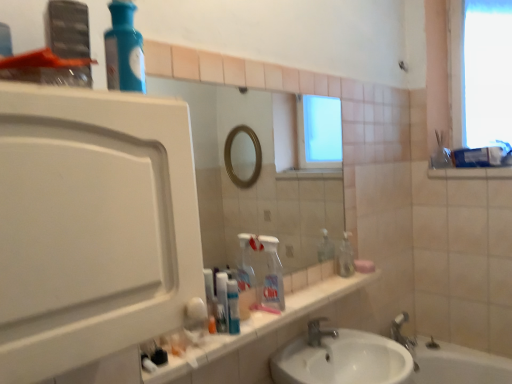
What do you see at coordinates (318, 331) in the screenshot?
I see `silver metallic faucet at sink center` at bounding box center [318, 331].

The image size is (512, 384). What do you see at coordinates (364, 266) in the screenshot? I see `pink matte soap at right` at bounding box center [364, 266].

Where is `white plastic toothpaste tube at center`? white plastic toothpaste tube at center is located at coordinates (222, 300).

The width and height of the screenshot is (512, 384). What do you see at coordinates (92, 225) in the screenshot? I see `white matte cabinet at left` at bounding box center [92, 225].

Identify the location of silver metallic faucet at sink center. The height and width of the screenshot is (384, 512). 318,331.

Starting from the pink matte soap at right, which cleaning product is the 1st one to the left? Please provide its 2D coordinates.

[(272, 274)]

How far apart are clear plastic bottle at center, which is the 1th cleaning product from back to front, and pink matte soap at right?

48.82 centimeters.

Between clear plastic bottle at center, the 2th cleaning product positioned from the front, and pink matte soap at right, which one has more height?

clear plastic bottle at center, the 2th cleaning product positioned from the front.

Considering the relative sizes of clear plastic bottle at center, the 2th cleaning product positioned from the front, and pink matte soap at right in the image provided, is clear plastic bottle at center, the 2th cleaning product positioned from the front, bigger than pink matte soap at right?

Yes, clear plastic bottle at center, the 2th cleaning product positioned from the front, is bigger than pink matte soap at right.

Would you say white glossy sink at lower center is outside clear plastic bottle at center, the 2th cleaning product positioned from the front?

Yes, white glossy sink at lower center is outside of clear plastic bottle at center, the 2th cleaning product positioned from the front.

In the scene shown: Considering the relative positions of white glossy sink at lower center and clear plastic bottle at center, which appears as the first cleaning product when ordered from the bottom, in the image provided, is white glossy sink at lower center to the left of clear plastic bottle at center, which appears as the first cleaning product when ordered from the bottom, from the viewer's perspective?

In fact, white glossy sink at lower center is to the right of clear plastic bottle at center, which appears as the first cleaning product when ordered from the bottom.

Is white glossy sink at lower center facing away from clear plastic bottle at center, the second cleaning product positioned from the top?

No, clear plastic bottle at center, the second cleaning product positioned from the top, is not at the back of white glossy sink at lower center.

Considering the positions of objects white matte cabinet at left and white glossy sink at lower center in the image provided, who is more to the right, white matte cabinet at left or white glossy sink at lower center?

white glossy sink at lower center.

Can you confirm if white matte cabinet at left is thinner than white glossy sink at lower center?

Yes, white matte cabinet at left is thinner than white glossy sink at lower center.

Is white matte cabinet at left located outside white glossy sink at lower center?

Indeed, white matte cabinet at left is completely outside white glossy sink at lower center.

Considering the sizes of objects white matte cabinet at left and white glossy sink at lower center in the image provided, who is bigger, white matte cabinet at left or white glossy sink at lower center?

Bigger between the two is white glossy sink at lower center.

Where is `tap on the right of the blue glass bottle at upper left, acting as the first cleaning product starting from the front`? Image resolution: width=512 pixels, height=384 pixels. tap on the right of the blue glass bottle at upper left, acting as the first cleaning product starting from the front is located at coordinates (318, 331).

Considering the sizes of objects blue glass bottle at upper left, which is the 1th cleaning product in left-to-right order, and silver metallic faucet at sink center in the image provided, who is taller, blue glass bottle at upper left, which is the 1th cleaning product in left-to-right order, or silver metallic faucet at sink center?

blue glass bottle at upper left, which is the 1th cleaning product in left-to-right order.

Is silver metallic faucet at sink center a part of blue glass bottle at upper left, marked as the second cleaning product in a back-to-front arrangement?

Actually, silver metallic faucet at sink center is outside blue glass bottle at upper left, marked as the second cleaning product in a back-to-front arrangement.

Looking at the image, does blue glass bottle at upper left, which ranks as the 2th cleaning product in bottom-to-top order, seem bigger or smaller compared to silver metallic faucet at sink center?

Clearly, blue glass bottle at upper left, which ranks as the 2th cleaning product in bottom-to-top order, is larger in size than silver metallic faucet at sink center.

Can you tell me how much white matte cabinet at left and white plastic toothpaste tube at center differ in facing direction?

0.891 degrees separate the facing orientations of white matte cabinet at left and white plastic toothpaste tube at center.

Are white matte cabinet at left and white plastic toothpaste tube at center making contact?

They are not placed beside each other.

From the image's perspective, is white matte cabinet at left located beneath white plastic toothpaste tube at center?

No, from the image's perspective, white matte cabinet at left is not beneath white plastic toothpaste tube at center.

Between white matte cabinet at left and white plastic toothpaste tube at center, which one appears on the left side from the viewer's perspective?

From the viewer's perspective, white matte cabinet at left appears more on the left side.

Is white plastic toothpaste tube at center inside the boundaries of translucent plastic soap dispenser at center, or outside?

white plastic toothpaste tube at center lies outside translucent plastic soap dispenser at center.

Considering the points (234, 286) and (339, 272), which point is in front, point (234, 286) or point (339, 272)?

The point (234, 286) is closer to the camera.

Is white plastic toothpaste tube at center aimed at translucent plastic soap dispenser at center?

No, white plastic toothpaste tube at center does not turn towards translucent plastic soap dispenser at center.

Does pink matte soap at right have a smaller size compared to silver metallic faucet at sink center?

Indeed, pink matte soap at right has a smaller size compared to silver metallic faucet at sink center.

Based on the photo, can you confirm if pink matte soap at right is positioned to the left of silver metallic faucet at sink center?

No, pink matte soap at right is not to the left of silver metallic faucet at sink center.

You are a GUI agent. You are given a task and a screenshot of the screen. Output one action in this format:
    pyautogui.click(x=<x>, y=<y>)
    Task: Click on the tap below the pink matte soap at right (from a real-world perspective)
    This screenshot has width=512, height=384.
    Given the screenshot: What is the action you would take?
    pyautogui.click(x=318, y=331)

Could silver metallic faucet at sink center be considered to be inside pink matte soap at right?

No, silver metallic faucet at sink center is not a part of pink matte soap at right.

Where is `the 1st cleaning product counting from the left of the pink matte soap at right`? This screenshot has width=512, height=384. the 1st cleaning product counting from the left of the pink matte soap at right is located at coordinates (272, 274).

Find the location of a particular element. The height and width of the screenshot is (384, 512). cleaning product behind the white glossy sink at lower center is located at coordinates (272, 274).

Considering their positions, is white plastic toothpaste tube at center positioned further to blue glass bottle at upper left, the second cleaning product viewed from the right, than white matte cabinet at left?

white plastic toothpaste tube at center is positioned further to the anchor blue glass bottle at upper left, the second cleaning product viewed from the right.

Consider the image. Based on their spatial positions, is white matte cabinet at left or translucent plastic soap dispenser at center further from clear plastic bottle at center, which is the 1th cleaning product from back to front?

The object further to clear plastic bottle at center, which is the 1th cleaning product from back to front, is white matte cabinet at left.

Which object lies nearer to the anchor point white plastic toothpaste tube at center, blue glass bottle at upper left, which ranks as the 2th cleaning product in bottom-to-top order, or white matte cabinet at left?

white matte cabinet at left is closer to white plastic toothpaste tube at center.

Estimate the real-world distances between objects in this image. Which object is closer to translucent plastic soap dispenser at center, silver metallic faucet at sink center or clear plastic bottle at center, the 2th cleaning product positioned from the front?

Among the two, silver metallic faucet at sink center is located nearer to translucent plastic soap dispenser at center.

When comparing their distances from white plastic toothpaste tube at center, does translucent plastic soap dispenser at center or white glossy sink at lower center seem closer?

Among the two, white glossy sink at lower center is located nearer to white plastic toothpaste tube at center.

Estimate the real-world distances between objects in this image. Which object is further from translucent plastic soap dispenser at center, white glossy sink at lower center or silver metallic faucet at sink center?

white glossy sink at lower center is positioned further to the anchor translucent plastic soap dispenser at center.

From the image, which object appears to be farther from white plastic toothpaste tube at center, blue glass bottle at upper left, which is the 1th cleaning product in left-to-right order, or white glossy sink at lower center?

Among the two, blue glass bottle at upper left, which is the 1th cleaning product in left-to-right order, is located further to white plastic toothpaste tube at center.

Looking at the image, which one is located closer to white plastic toothpaste tube at center, pink matte soap at right or white matte cabinet at left?

Based on the image, pink matte soap at right appears to be nearer to white plastic toothpaste tube at center.

This screenshot has width=512, height=384. I want to click on tap between white glossy sink at lower center and translucent plastic soap dispenser at center in the front-back direction, so click(318, 331).

I want to click on toiletry between blue glass bottle at upper left, the 1th cleaning product viewed from the top, and translucent plastic soap dispenser at center from front to back, so click(222, 300).

Locate an element on the screen. cleaning product positioned between blue glass bottle at upper left, which is the 1th cleaning product in left-to-right order, and pink matte soap at right from near to far is located at coordinates (272, 274).

Find the location of a particular element. The width and height of the screenshot is (512, 384). tap between white matte cabinet at left and translucent plastic soap dispenser at center from front to back is located at coordinates (318, 331).